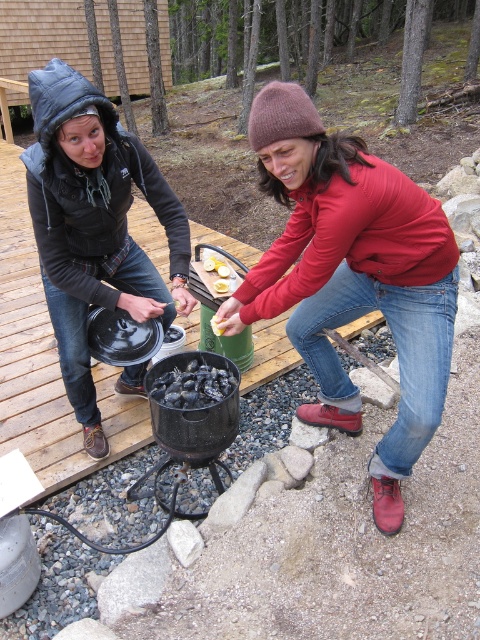
Looking at this image, you are organizing a camping trip and need to pack items from the scene. If the red matte jacket at center and the yellow rubber glove at center must both fit into a backpack compartment that can only accommodate items up to the width of the wider object, which item determines the minimum required width of the compartment?

The red matte jacket at center determines the minimum required width of the compartment because its width surpasses that of the yellow rubber glove at center.